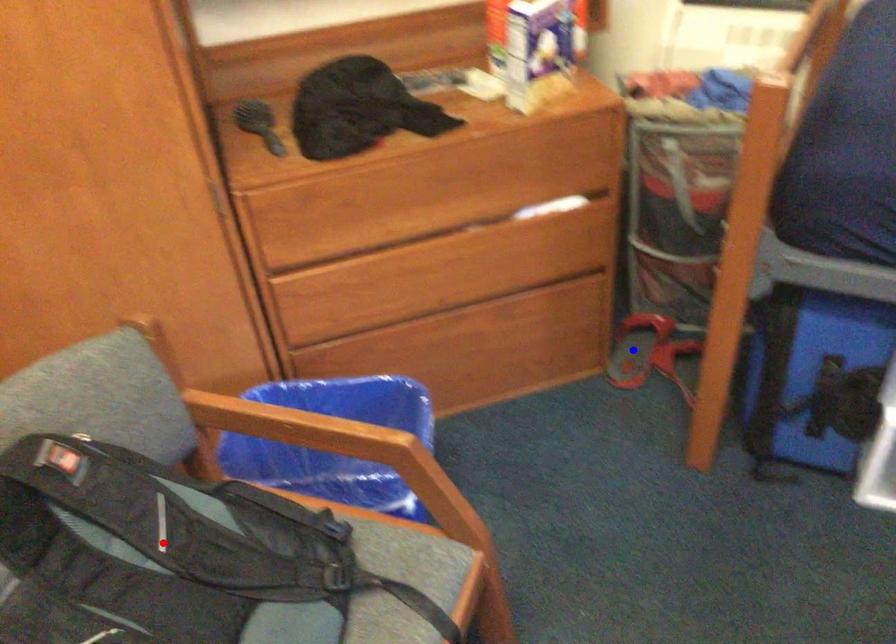
Question: Which of the two points in the image is closer to the camera?

Choices:
 (A) Blue point is closer.
 (B) Red point is closer.

Answer: (B)